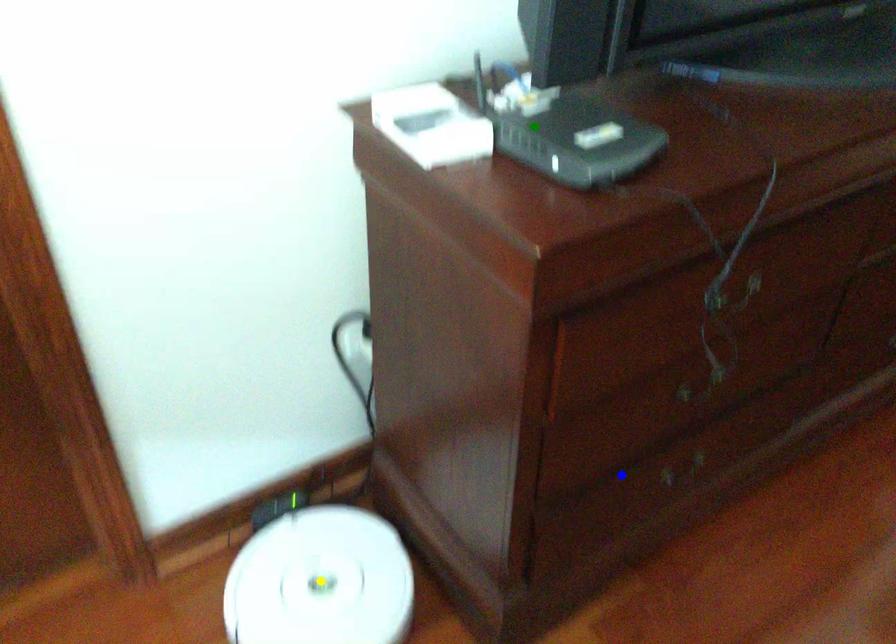
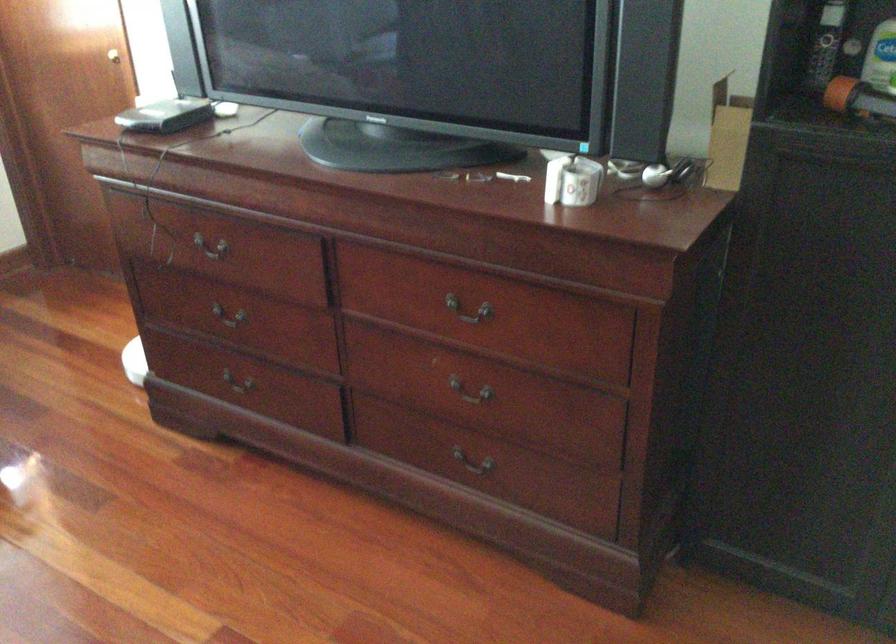
I am providing you with two images of the same scene from different viewpoints. Three points are marked in image1. Which point corresponds to a part or object that is occluded in image2?In image1, three points are marked. Which of them correspond to a part or object that is occluded in image2?Among the three points shown in image1, which one corresponds to a part or object that is no longer visible due to occlusion in image2?

yellow point cannot be seen in image2.